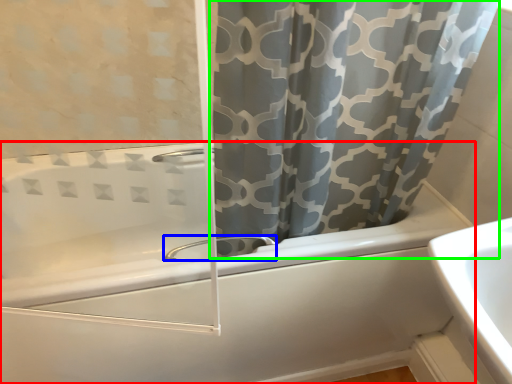
Question: Considering the real-world distances, which object is farthest from bathtub (highlighted by a red box)? tap (highlighted by a blue box) or curtain (highlighted by a green box)?

Choices:
 (A) tap
 (B) curtain

Answer: (B)